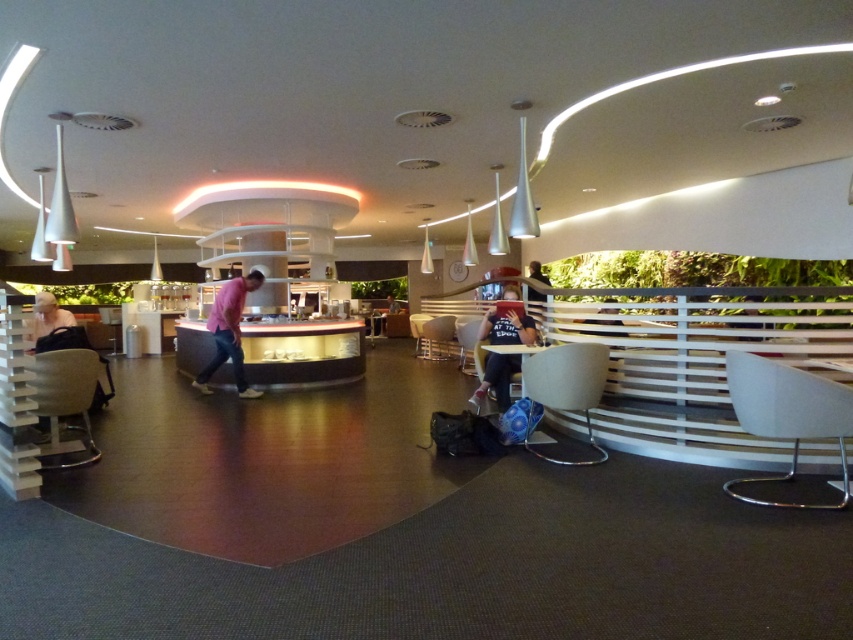
Question: Among these objects, which one is farthest from the camera?

Choices:
 (A) matte black jacket at left
 (B) matte black shirt at center
 (C) pink cotton shirt at center
 (D) dark blue jeans at center

Answer: (D)

Question: Can you confirm if matte black shirt at center is positioned below dark blue jeans at center?

Choices:
 (A) yes
 (B) no

Answer: (A)

Question: Which of these objects is positioned closest to the dark blue jeans at center?

Choices:
 (A) matte black shirt at center
 (B) pink cotton shirt at center

Answer: (A)

Question: Which of these objects is positioned farthest from the pink cotton shirt at center?

Choices:
 (A) dark blue jeans at center
 (B) matte black shirt at center
 (C) matte black jacket at left

Answer: (A)

Question: Does matte black jacket at left appear under dark blue jeans at center?

Choices:
 (A) no
 (B) yes

Answer: (B)

Question: Is the position of matte black jacket at left less distant than that of dark blue jeans at center?

Choices:
 (A) no
 (B) yes

Answer: (B)